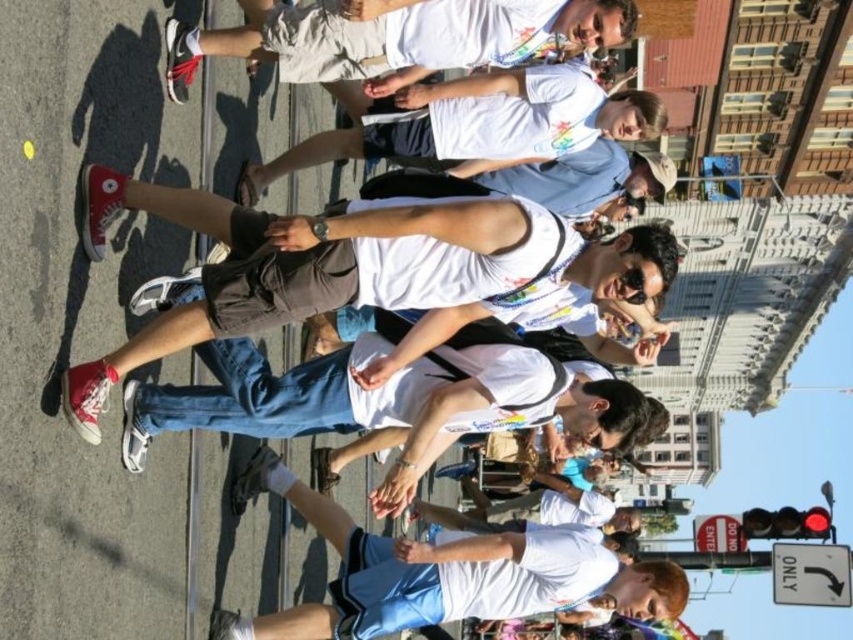
Measure the distance between matte red sneakers at left and camera.

matte red sneakers at left and camera are 24.39 meters apart.

Which is below, matte red sneakers at left or white matte t-shirt at center?

white matte t-shirt at center

Image resolution: width=853 pixels, height=640 pixels. I want to click on matte red sneakers at left, so click(358, 266).

You are a GUI agent. You are given a task and a screenshot of the screen. Output one action in this format:
    pyautogui.click(x=<x>, y=<y>)
    Task: Click on the matte red sneakers at left
    The image size is (853, 640).
    Given the screenshot: What is the action you would take?
    pyautogui.click(x=358, y=266)

Who is higher up, matte red sneakers at left or white t-shirt at center?

white t-shirt at center is higher up.

Is matte red sneakers at left above white t-shirt at center?

Actually, matte red sneakers at left is below white t-shirt at center.

This screenshot has height=640, width=853. Identify the location of matte red sneakers at left. (358, 266).

What are the coordinates of `matte red sneakers at left` in the screenshot? It's located at (358, 266).

Can you confirm if white matte t-shirt at center is taller than white t-shirt at center?

Indeed, white matte t-shirt at center has a greater height compared to white t-shirt at center.

Is white matte t-shirt at center thinner than white t-shirt at center?

In fact, white matte t-shirt at center might be wider than white t-shirt at center.

Which is in front, point (374, 397) or point (308, 60)?

Point (374, 397) is in front.

Identify the location of white matte t-shirt at center. The height and width of the screenshot is (640, 853). (387, 394).